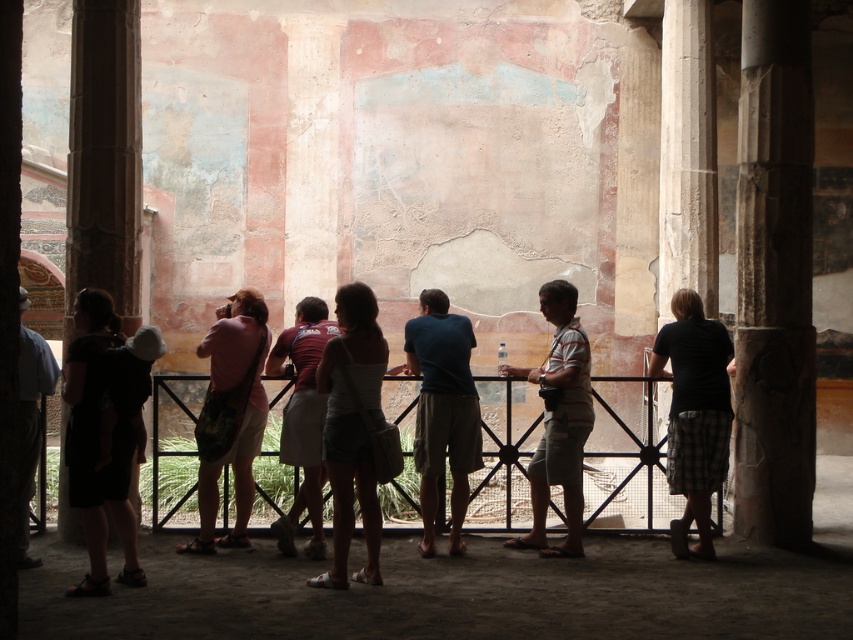
Question: Estimate the real-world distances between objects in this image. Which object is farther from the maroon fabric shirt at center?

Choices:
 (A) pink fabric dress at center
 (B) dark brown stone pillar at right
 (C) striped cotton shirt at center

Answer: (B)

Question: Can you confirm if white fabric dress at center is positioned to the right of pink fabric dress at center?

Choices:
 (A) yes
 (B) no

Answer: (A)

Question: Can you confirm if dark brown stone pillar at right is positioned to the right of dark gray shirt at left?

Choices:
 (A) no
 (B) yes

Answer: (B)

Question: Does black cotton shirt at right have a lesser width compared to striped cotton shirt at center?

Choices:
 (A) yes
 (B) no

Answer: (B)

Question: Which object is farther from the camera taking this photo?

Choices:
 (A) maroon fabric shirt at center
 (B) striped cotton shirt at center
 (C) pink fabric dress at center
 (D) black cotton shirt at right

Answer: (B)

Question: Which object appears closest to the camera in this image?

Choices:
 (A) dark brown stone pillar at right
 (B) dark brown stone pillar at left
 (C) pink fabric dress at center

Answer: (C)